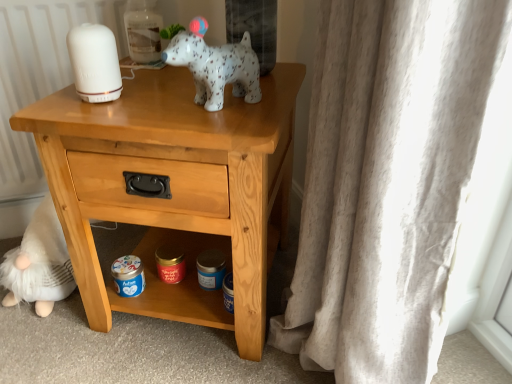
Locate an element on the screen. light wood nightstand at center is located at coordinates (174, 189).

From the picture: Measure the distance between white matte bottle at upper center and camera.

white matte bottle at upper center is 3.41 feet away from camera.

The height and width of the screenshot is (384, 512). Describe the element at coordinates (39, 263) in the screenshot. I see `white fluffy gnome at lower left` at that location.

Locate an element on the screen. light wood nightstand at center is located at coordinates [x=174, y=189].

Does light wood nightstand at center have a lesser height compared to white speckled ceramic dog at upper center?

No.

Is light wood nightstand at center wider than white speckled ceramic dog at upper center?

Yes, light wood nightstand at center is wider than white speckled ceramic dog at upper center.

Is light wood nightstand at center bigger than white speckled ceramic dog at upper center?

Correct, light wood nightstand at center is larger in size than white speckled ceramic dog at upper center.

Is point (263, 172) closer or farther from the camera than point (250, 38)?

Clearly, point (263, 172) is closer to the camera than point (250, 38).

Is point (9, 255) closer or farther from the camera than point (200, 80)?

Point (9, 255) appears to be farther away from the viewer than point (200, 80).

Is white fluffy gnome at lower left not near white speckled ceramic dog at upper center?

Actually, white fluffy gnome at lower left and white speckled ceramic dog at upper center are a little close together.

Can you tell me how much white fluffy gnome at lower left and white speckled ceramic dog at upper center differ in facing direction?

The angle between the facing direction of white fluffy gnome at lower left and the facing direction of white speckled ceramic dog at upper center is 33.1 degrees.

Considering the sizes of objects white fluffy gnome at lower left and white matte bottle at upper center in the image provided, who is thinner, white fluffy gnome at lower left or white matte bottle at upper center?

white matte bottle at upper center.

Considering the points (59, 244) and (155, 25), which point is in front, point (59, 244) or point (155, 25)?

Positioned in front is point (155, 25).

From the image's perspective, is white fluffy gnome at lower left below white matte bottle at upper center?

Yes.

There is a white fluffy gnome at lower left. At what (x,y) coordinates should I click in order to perform the action: click on bottle above it (from a real-world perspective). Please return your answer as a coordinate pair (x, y). The height and width of the screenshot is (384, 512). Looking at the image, I should click on (143, 30).

Could you tell me if light wood nightstand at center is facing white matte bottle at upper center?

No, light wood nightstand at center is not turned towards white matte bottle at upper center.

Is light wood nightstand at center located outside white matte bottle at upper center?

Yes, light wood nightstand at center is not within white matte bottle at upper center.

From the image's perspective, is light wood nightstand at center positioned above or below white matte bottle at upper center?

light wood nightstand at center is below white matte bottle at upper center.

Where is `bottle that appears on the left of light wood nightstand at center`? Image resolution: width=512 pixels, height=384 pixels. bottle that appears on the left of light wood nightstand at center is located at coordinates (143, 30).

Which is farther, (160, 26) or (55, 220)?

The point (55, 220) is more distant.

The height and width of the screenshot is (384, 512). Identify the location of figurine that is below the white matte bottle at upper center (from the image's perspective). (39, 263).

Consider the image. Is white matte bottle at upper center spatially inside white fluffy gnome at lower left, or outside of it?

white matte bottle at upper center is outside white fluffy gnome at lower left.

Considering the relative sizes of white matte bottle at upper center and white fluffy gnome at lower left in the image provided, is white matte bottle at upper center taller than white fluffy gnome at lower left?

In fact, white matte bottle at upper center may be shorter than white fluffy gnome at lower left.

Is white speckled ceramic dog at upper center aimed at light wood nightstand at center?

No, white speckled ceramic dog at upper center is not turned towards light wood nightstand at center.

In the scene shown: Which point is more distant from viewer, (203, 49) or (264, 125)?

The point (203, 49) is behind.

Is white speckled ceramic dog at upper center not inside light wood nightstand at center?

Yes, white speckled ceramic dog at upper center is outside of light wood nightstand at center.

Which object is positioned more to the right, white speckled ceramic dog at upper center or light wood nightstand at center?

Positioned to the right is white speckled ceramic dog at upper center.

Does light wood nightstand at center have a larger size compared to white fluffy gnome at lower left?

Indeed, light wood nightstand at center has a larger size compared to white fluffy gnome at lower left.

Is light wood nightstand at center oriented away from white fluffy gnome at lower left?

light wood nightstand at center is not turned away from white fluffy gnome at lower left.

Is light wood nightstand at center positioned far away from white fluffy gnome at lower left?

No.

Is point (94, 168) closer to camera compared to point (56, 255)?

Yes, it is in front of point (56, 255).

Find the location of `nightstand that is behind the white speckled ceramic dog at upper center`. nightstand that is behind the white speckled ceramic dog at upper center is located at coordinates (174, 189).

Where is `figurine below the white speckled ceramic dog at upper center (from the image's perspective)`? This screenshot has height=384, width=512. figurine below the white speckled ceramic dog at upper center (from the image's perspective) is located at coordinates (39, 263).

Looking at the image, which one is located closer to white matte bottle at upper center, white speckled ceramic dog at upper center or white fluffy gnome at lower left?

white speckled ceramic dog at upper center lies closer to white matte bottle at upper center than the other object.

Consider the image. When comparing their distances from white matte bottle at upper center, does light wood nightstand at center or white fluffy gnome at lower left seem further?

Based on the image, white fluffy gnome at lower left appears to be further to white matte bottle at upper center.

Considering their positions, is light wood nightstand at center positioned closer to white matte bottle at upper center than white speckled ceramic dog at upper center?

Among the two, white speckled ceramic dog at upper center is located nearer to white matte bottle at upper center.

From the image, which object appears to be farther from white speckled ceramic dog at upper center, white matte bottle at upper center or white fluffy gnome at lower left?

Among the two, white fluffy gnome at lower left is located further to white speckled ceramic dog at upper center.

From the image, which object appears to be nearer to white speckled ceramic dog at upper center, white matte bottle at upper center or light wood nightstand at center?

Among the two, light wood nightstand at center is located nearer to white speckled ceramic dog at upper center.

From the image, which object appears to be nearer to white fluffy gnome at lower left, light wood nightstand at center or white matte bottle at upper center?

light wood nightstand at center is closer to white fluffy gnome at lower left.

From the picture: Based on their spatial positions, is white matte bottle at upper center or white fluffy gnome at lower left closer to light wood nightstand at center?

white fluffy gnome at lower left.

Which object lies further to the anchor point light wood nightstand at center, white speckled ceramic dog at upper center or white matte bottle at upper center?

white matte bottle at upper center is further to light wood nightstand at center.

Where is `toy between white matte bottle at upper center and light wood nightstand at center from top to bottom`? Image resolution: width=512 pixels, height=384 pixels. toy between white matte bottle at upper center and light wood nightstand at center from top to bottom is located at coordinates (215, 66).

This screenshot has width=512, height=384. I want to click on nightstand between white matte bottle at upper center and white fluffy gnome at lower left in the up-down direction, so point(174,189).

What are the coordinates of `nightstand between white fluffy gnome at lower left and white speckled ceramic dog at upper center from left to right` in the screenshot? It's located at (174, 189).

Identify the location of toy between white matte bottle at upper center and white fluffy gnome at lower left from top to bottom. (215, 66).